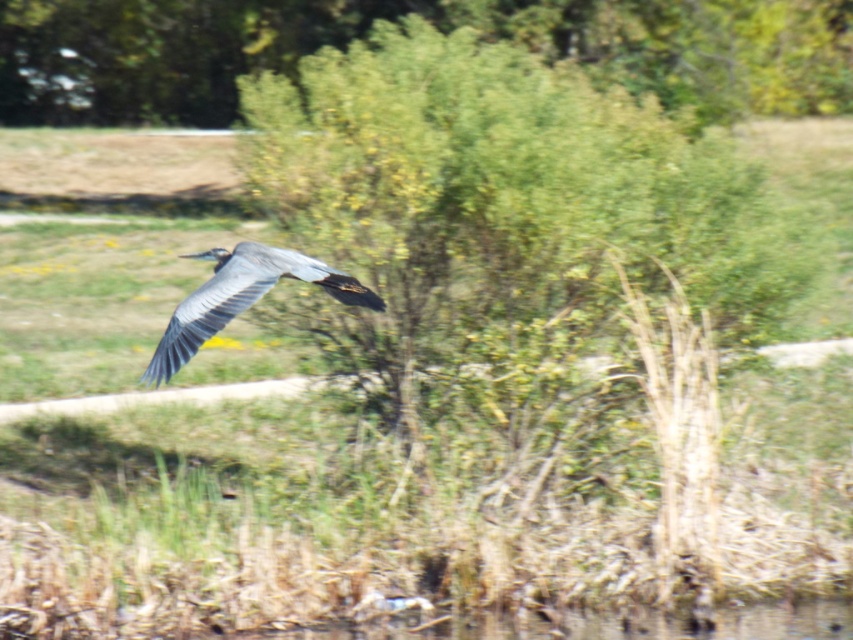
Which is more to the left, green leafy tree at upper center or gray matte bird at center?

gray matte bird at center is more to the left.

Which is above, green leafy tree at upper center or gray matte bird at center?

green leafy tree at upper center is higher up.

Is point (178, 52) positioned after point (241, 268)?

Yes, it is.

At what (x,y) coordinates should I click in order to perform the action: click on green leafy tree at upper center. Please return your answer as a coordinate pair (x, y). The width and height of the screenshot is (853, 640). Looking at the image, I should click on (433, 22).